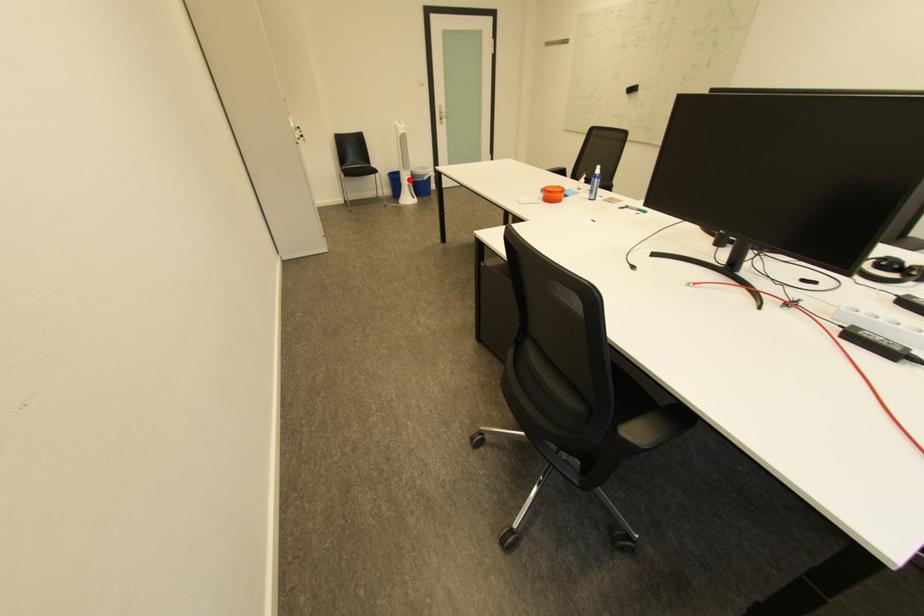
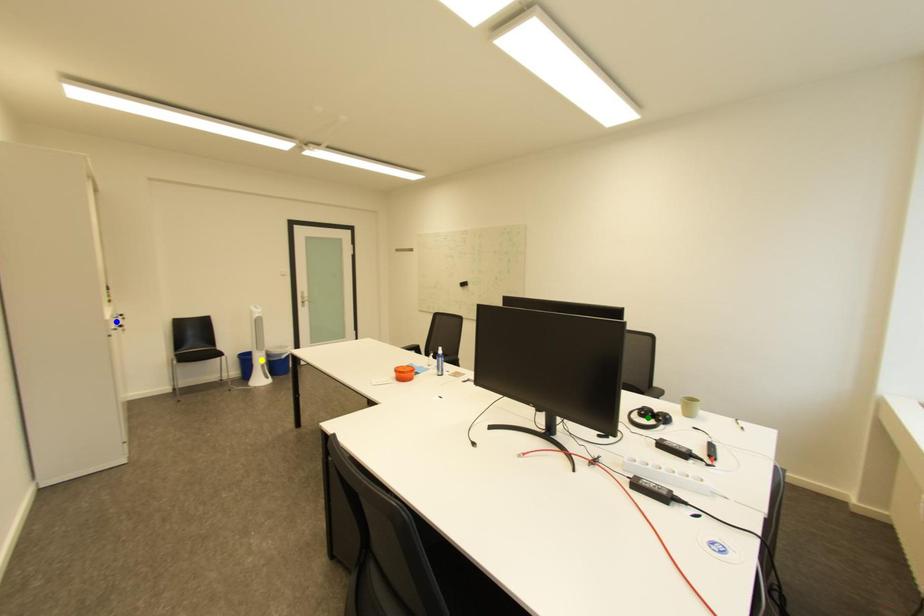
Question: I am providing you with two images of the same scene from different viewpoints. A red point is marked on the first image. You are given multiple points on the second image. In image 2, which mark is for the same physical point as the one in image 1?

Choices:
 (A) blue point
 (B) green point
 (C) yellow point

Answer: (C)